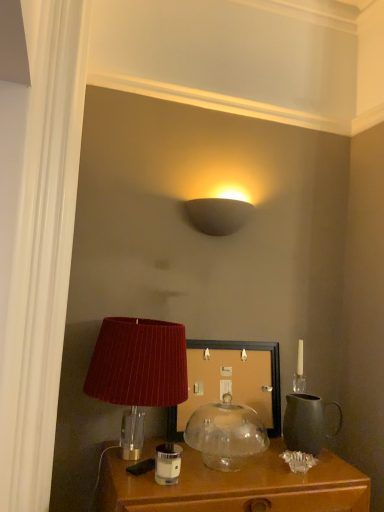
Question: Do you think matte wooden picture frame at center is within velvet red lampshade at lower left, which is the 2th lamp from bottom to top, or outside of it?

Choices:
 (A) inside
 (B) outside

Answer: (B)

Question: In terms of size, does matte wooden picture frame at center appear bigger or smaller than velvet red lampshade at lower left, arranged as the 2th lamp when viewed from the top?

Choices:
 (A) small
 (B) big

Answer: (A)

Question: Which is farther from the transparent glass dome at center, marked as the first lamp in a bottom-to-top arrangement?

Choices:
 (A) matte gray wall sconce at upper center, placed as the 1th lamp when sorted from top to bottom
 (B) clear glass candle holder at lower center
 (C) matte black pitcher at right
 (D) velvet red lampshade at lower left, which is the 2th lamp from bottom to top
 (E) matte wooden picture frame at center

Answer: (A)

Question: Estimate the real-world distances between objects in this image. Which object is farther from the matte gray wall sconce at upper center, marked as the 3th lamp in a bottom-to-top arrangement?

Choices:
 (A) transparent glass dome at center, the 3th lamp when ordered from top to bottom
 (B) velvet red lampshade at lower left, arranged as the 2th lamp when viewed from the top
 (C) matte wooden picture frame at center
 (D) clear glass candle holder at lower center
 (E) matte black pitcher at right

Answer: (D)